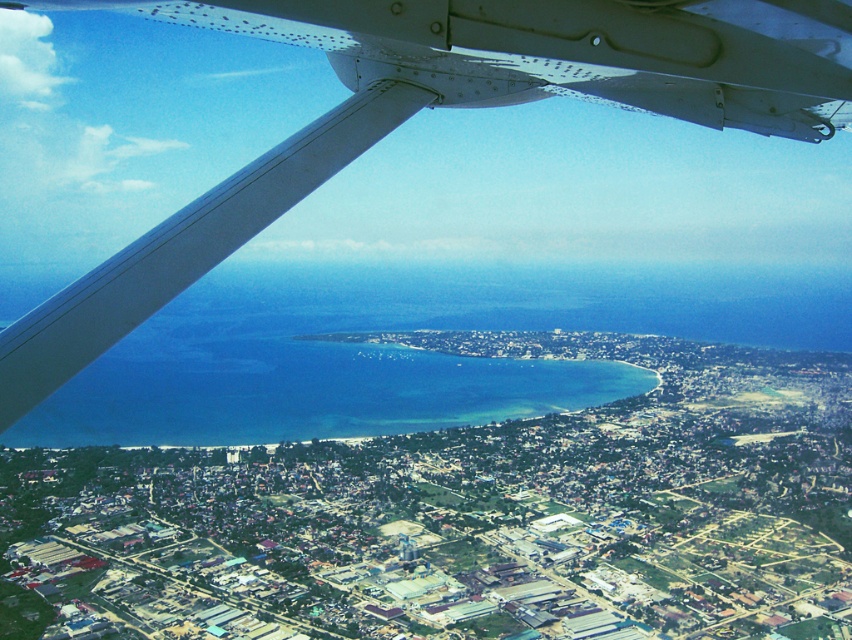
You are a pilot who needs to ensure that the white matte wing at upper left does not block the view of the clear blue water at center during your flight. Based on their sizes, which object would be easier to adjust your viewing angle to focus on?

The clear blue water at center is smaller in size than the white matte wing at upper left, so adjusting the viewing angle to focus on the clear blue water at center would be easier since it requires less adjustment compared to the larger wing.